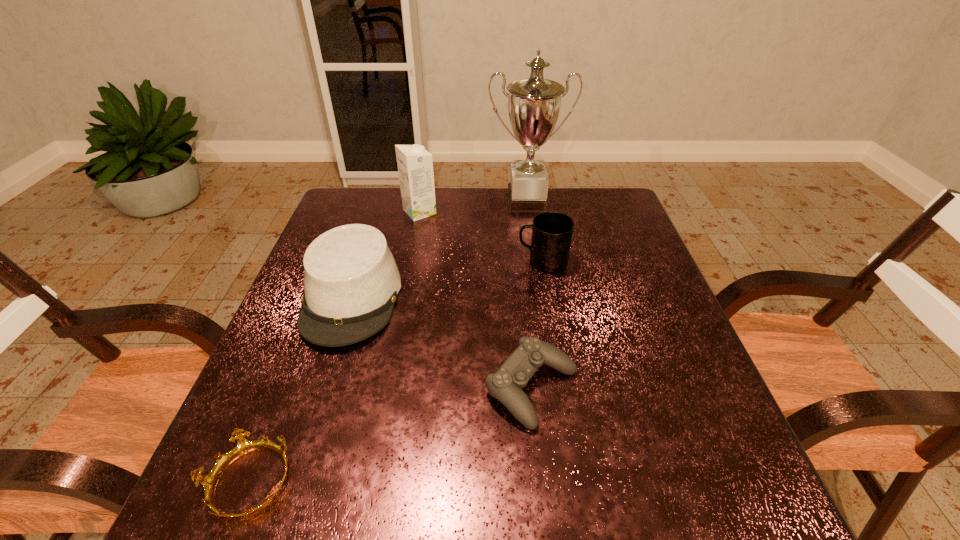
Identify the location of free space located on the side of the mug with the handle. The width and height of the screenshot is (960, 540). (408, 261).

Identify the location of vacant space located on the front-facing side of the hat. The image size is (960, 540). (294, 481).

Identify the location of vacant space located 0.290m on the back of the control. This screenshot has height=540, width=960. (518, 264).

What are the coordinates of `vacant space located 0.140m on the back of the nearest object` in the screenshot? It's located at (290, 379).

Where is `trophy cup located at the far edge`? trophy cup located at the far edge is located at coordinates (534, 104).

Locate an element on the screen. This screenshot has height=540, width=960. carton that is positioned at the far edge is located at coordinates [415, 164].

Locate an element on the screen. object that is positioned at the near edge is located at coordinates (244, 446).

Find the location of a particular element. hat at the left edge is located at coordinates (351, 281).

What are the coordinates of `crown that is at the left edge` in the screenshot? It's located at (244, 446).

The width and height of the screenshot is (960, 540). In order to click on object that is at the near left corner in this screenshot , I will do `click(244, 446)`.